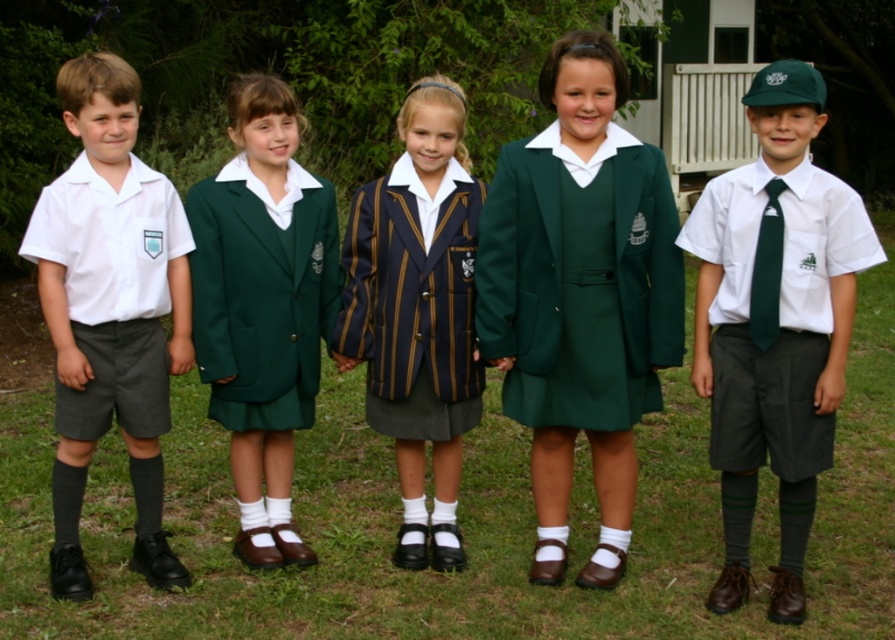
Between matte green tie at right and striped wool blazer at center, which one has less height?

With less height is striped wool blazer at center.

Who is more forward, (x=851, y=241) or (x=356, y=317)?

Positioned in front is point (x=851, y=241).

Where is `matte green tie at right`? Image resolution: width=895 pixels, height=640 pixels. matte green tie at right is located at coordinates (774, 323).

Who is more distant from viewer, (54, 241) or (467, 372)?

The point (467, 372) is behind.

Is matte white shirt at left to the left of striped wool blazer at center from the viewer's perspective?

Correct, you'll find matte white shirt at left to the left of striped wool blazer at center.

Image resolution: width=895 pixels, height=640 pixels. Describe the element at coordinates (109, 310) in the screenshot. I see `matte white shirt at left` at that location.

You are a GUI agent. You are given a task and a screenshot of the screen. Output one action in this format:
    pyautogui.click(x=<x>, y=<y>)
    Task: Click on the matte white shirt at left
    
    Given the screenshot: What is the action you would take?
    pyautogui.click(x=109, y=310)

Can you confirm if green grass at center is positioned to the left of striped wool blazer at center?

Indeed, green grass at center is positioned on the left side of striped wool blazer at center.

Which is above, green grass at center or striped wool blazer at center?

striped wool blazer at center is above.

Is point (648, 525) positioned after point (440, 481)?

Yes, point (648, 525) is behind point (440, 481).

This screenshot has width=895, height=640. Find the location of `green grass at center`. green grass at center is located at coordinates (459, 524).